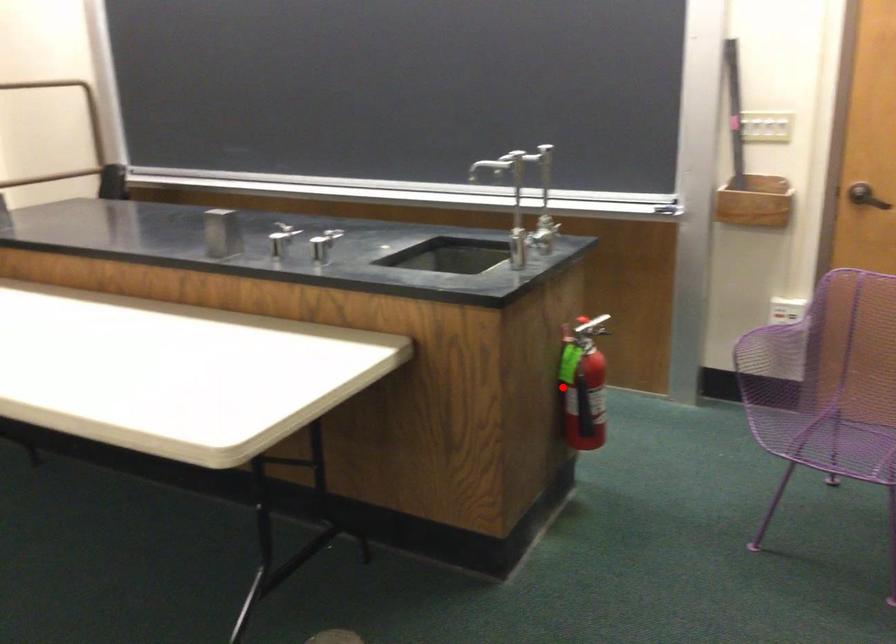
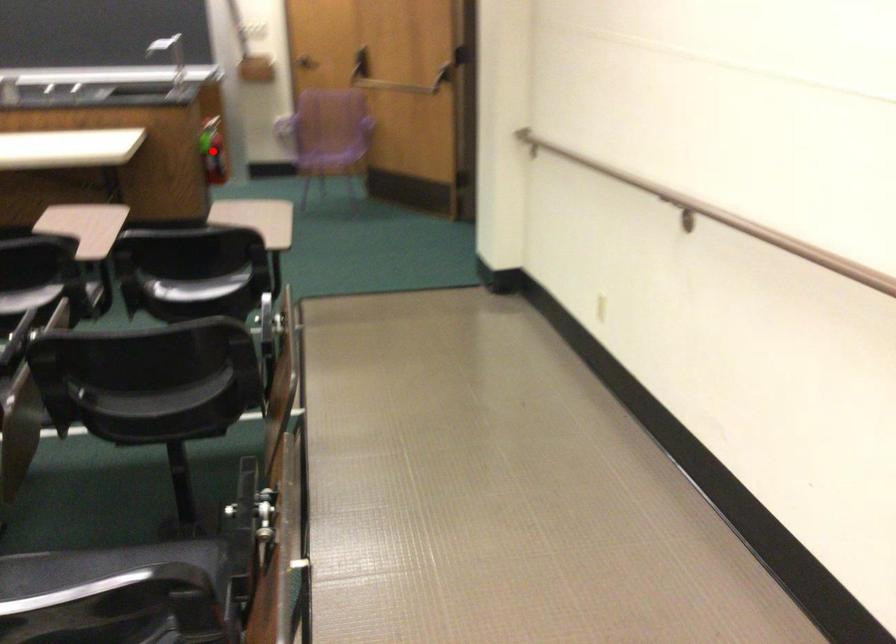
I am providing you with two images of the same scene from different viewpoints. A red point is marked on the first image and another point is marked on the second image. Do the highlighted points in image1 and image2 indicate the same real-world spot?

Yes